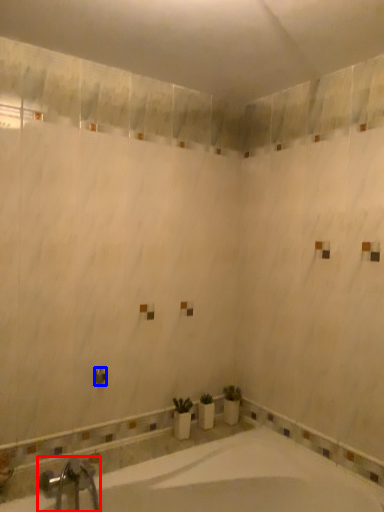
Question: Which point is further to the camera, tap (highlighted by a red box) or shower (highlighted by a blue box)?

Choices:
 (A) tap
 (B) shower

Answer: (B)